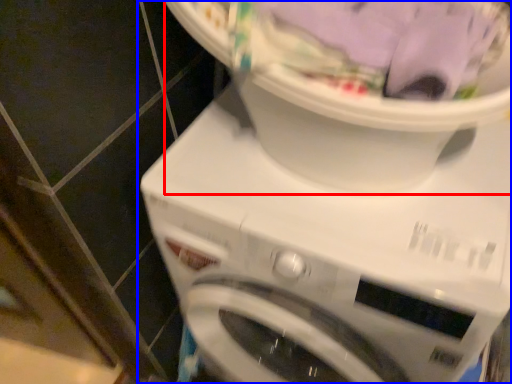
Question: Which object is further to the camera taking this photo, machine (highlighted by a red box) or washing machine (highlighted by a blue box)?

Choices:
 (A) machine
 (B) washing machine

Answer: (B)